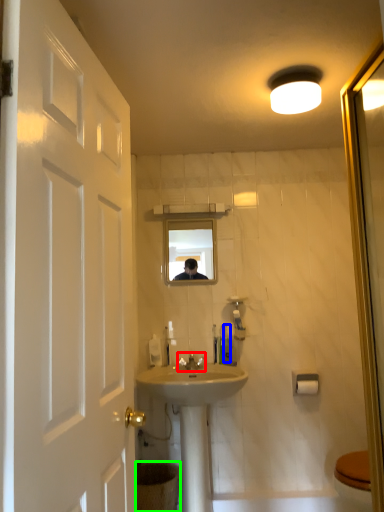
Question: Considering the real-world distances, which object is farthest from tap (highlighted by a red box)? toiletry (highlighted by a blue box) or toilet bowl (highlighted by a green box)?

Choices:
 (A) toiletry
 (B) toilet bowl

Answer: (B)